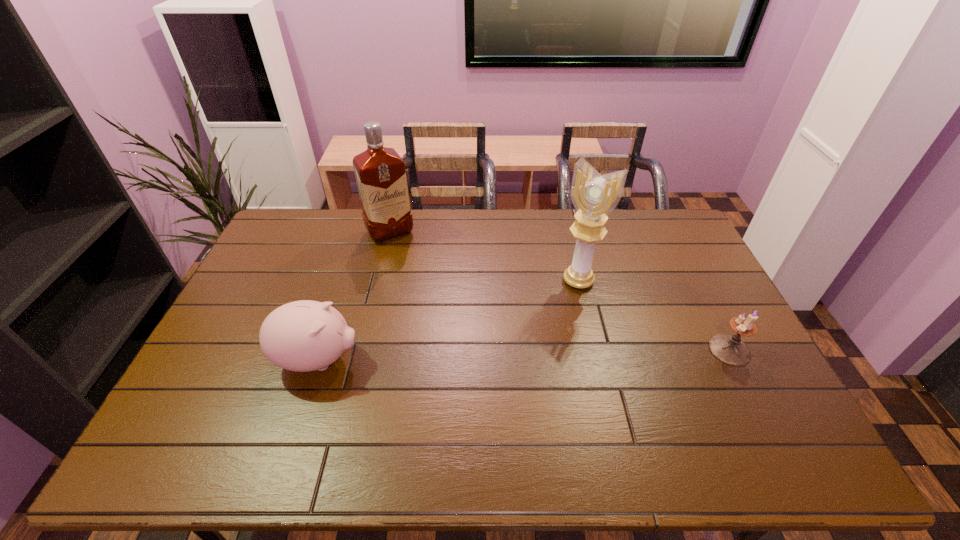
This screenshot has width=960, height=540. Identify the location of piggy bank. tap(302, 336).

Find the location of a particular element. The width and height of the screenshot is (960, 540). candle holder is located at coordinates pyautogui.click(x=729, y=349).

Identify the location of liquor. (380, 172).

Identify the location of the third object from left to right. This screenshot has height=540, width=960. (594, 196).

At what (x,y) coordinates should I click in order to perform the action: click on the third nearest object. Please return your answer as a coordinate pair (x, y). This screenshot has width=960, height=540. Looking at the image, I should click on (594, 196).

At what (x,y) coordinates should I click in order to perform the action: click on vacant space positioned at the snout of the piggy bank. Please return your answer as a coordinate pair (x, y). Looking at the image, I should click on (397, 360).

At what (x,y) coordinates should I click in order to perform the action: click on vacant space located on the left of the rightmost object. Please return your answer as a coordinate pair (x, y). Image resolution: width=960 pixels, height=540 pixels. Looking at the image, I should click on (682, 350).

The image size is (960, 540). In order to click on vacant space situated on the front label of the liquor in this screenshot , I will do `click(403, 252)`.

Identify the location of free point located 0.170m on the front label of the liquor. The image size is (960, 540). (416, 272).

The width and height of the screenshot is (960, 540). I want to click on vacant space located on the front label of the liquor, so click(405, 255).